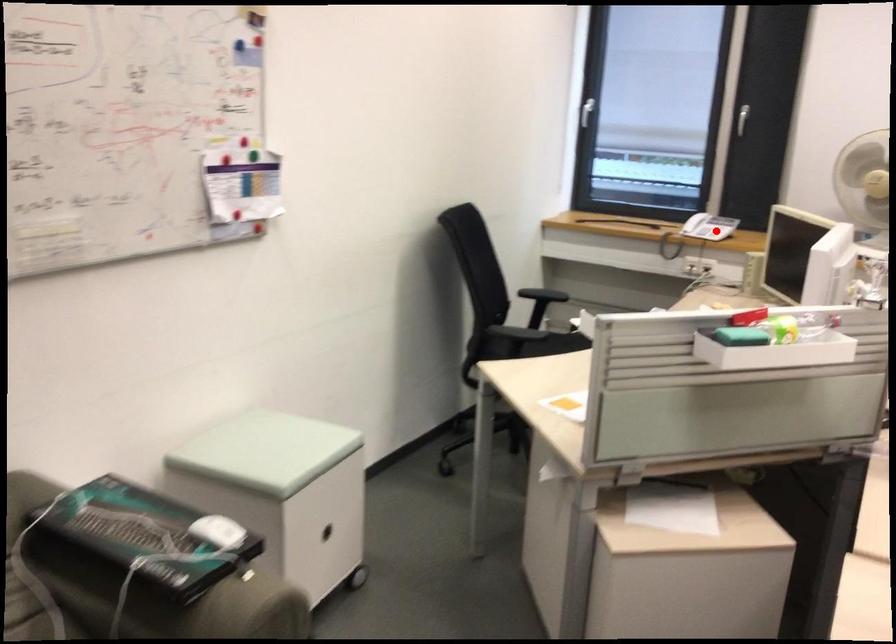
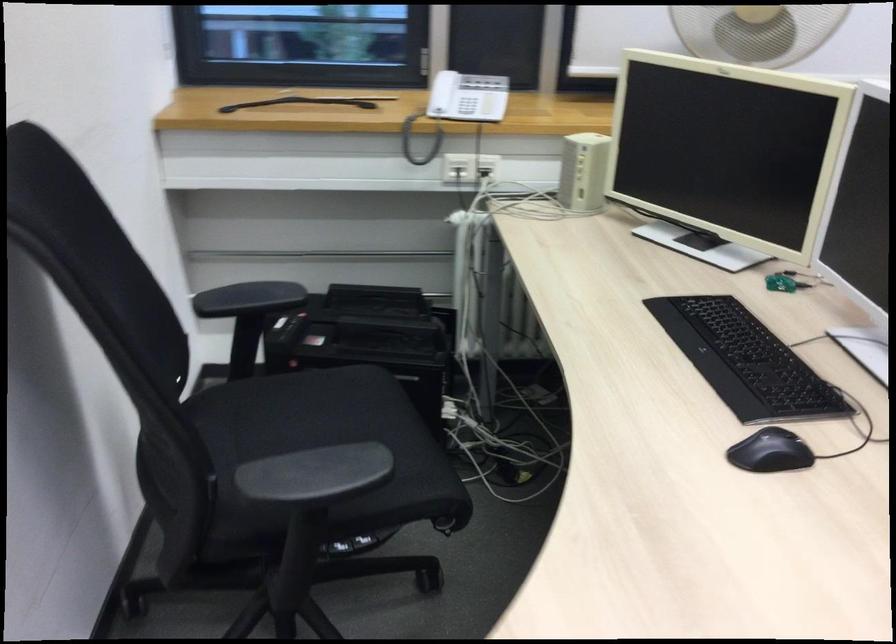
Find the pixel in the second image that matches the highlighted location in the first image.

(459, 106)